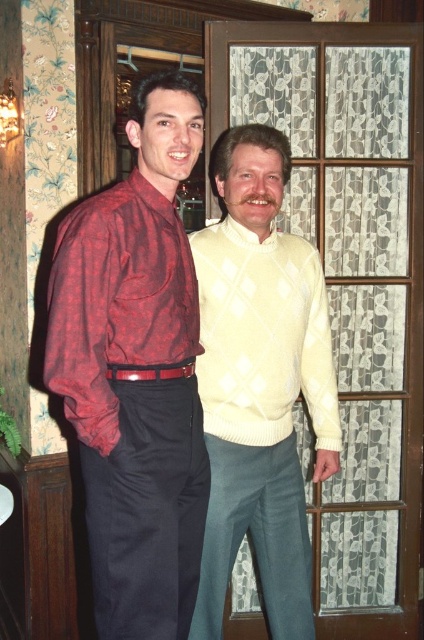
You are standing in a room with two people. You see a matte yellow sweater at center and a matte red plaid shirt at left. Which clothing item is closer to you?

The matte yellow sweater at center is closer to you because it is positioned further to the viewer than the matte red plaid shirt at left.

You are trying to decide which sweater to take home from a store. You see the matte yellow sweater at center and the cream knitted sweater at center. Which one is bigger?

The matte yellow sweater at center is larger in size compared to the cream knitted sweater at center.

You are organizing a clothing donation drive and need to determine if the plaid shirt at left and the cream knitted sweater at center can fit into a standard donation box that is 30 cm wide. Which item might not fit if the box is only 30 cm wide?

The cream knitted sweater at center is thicker than the plaid shirt at left, so the cream knitted sweater at center might not fit into the 30 cm wide donation box.